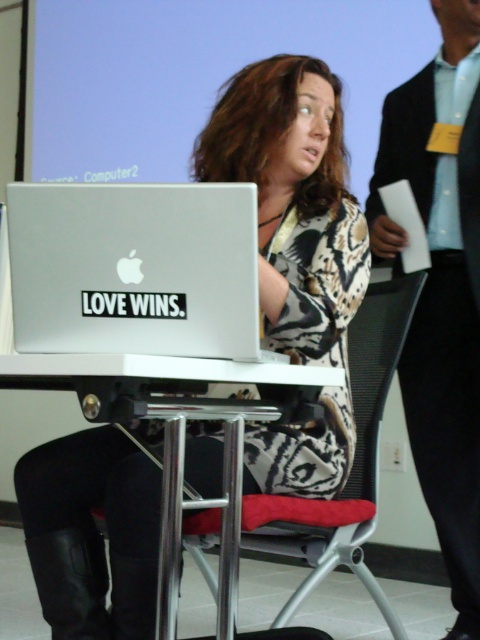
Question: Which object appears farthest from the camera in this image?

Choices:
 (A) black mesh chair at center
 (B) matte silver laptop at center
 (C) white plastic table at center
 (D) silver metallic laptop at center

Answer: (A)

Question: Does matte silver laptop at center have a greater width compared to black mesh chair at center?

Choices:
 (A) yes
 (B) no

Answer: (B)

Question: Does matte silver laptop at center have a lesser width compared to light blue shirt at upper right?

Choices:
 (A) no
 (B) yes

Answer: (A)

Question: Is silver metallic laptop at center thinner than white plastic table at center?

Choices:
 (A) no
 (B) yes

Answer: (B)

Question: Which of the following is the closest to the observer?

Choices:
 (A) (330, 412)
 (B) (456, 208)

Answer: (A)

Question: Among these objects, which one is nearest to the camera?

Choices:
 (A) black mesh chair at center
 (B) matte silver laptop at center

Answer: (B)